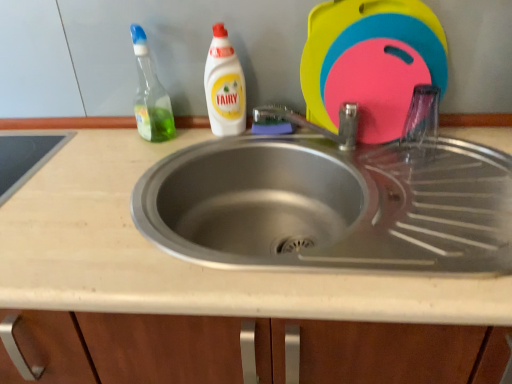
This screenshot has width=512, height=384. What are the coordinates of `vacant space to the right of green translucent bottle at upper left, acting as the second cleaning product starting from the right` in the screenshot? It's located at (211, 139).